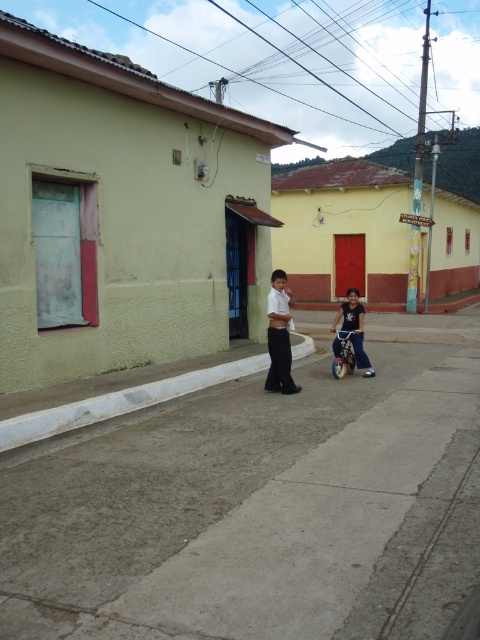
In the scene shown: You are a delivery person driving a van that is 2 meters long. You need to park your van on the gray concrete pavement at center near the white concrete curb at lower center. Can you park your van there without crossing over the curb?

The gray concrete pavement at center is positioned under the white concrete curb at lower center, so parking the van there would require crossing over the curb. Therefore, the van cannot be parked there without crossing over the curb.

You are a parent pushing a metallic silver stroller at center along the gray concrete pavement at center. Can you tell me if the pavement has enough space for the stroller to move freely?

The gray concrete pavement at center is larger in size than the metallic silver stroller at center, so there is enough space for the stroller to move freely.